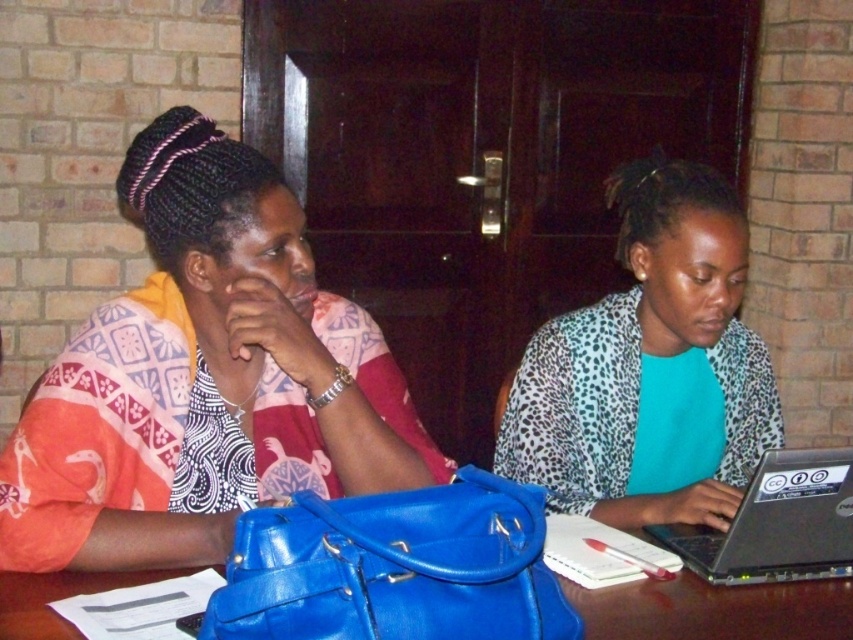
Question: Among these objects, which one is nearest to the camera?

Choices:
 (A) leopard print blazer at right
 (B) silver metallic laptop at center
 (C) blue leather bag at center
 (D) matte fabric scarf at left

Answer: (C)

Question: Which point is closer to the camera taking this photo?

Choices:
 (A) (250, 369)
 (B) (708, 268)
 (C) (793, 518)
 (D) (776, 609)

Answer: (D)

Question: Can you confirm if matte fabric scarf at left is positioned to the right of leopard print blazer at right?

Choices:
 (A) no
 (B) yes

Answer: (A)

Question: Which object is farther from the camera taking this photo?

Choices:
 (A) silver metallic laptop at center
 (B) blue leather bag at center
 (C) matte fabric scarf at left
 (D) leopard print blazer at right

Answer: (A)

Question: In this image, where is matte fabric scarf at left located relative to blue leather bag at center?

Choices:
 (A) right
 (B) left

Answer: (B)

Question: Is leopard print blazer at right thinner than silver metallic laptop at center?

Choices:
 (A) yes
 (B) no

Answer: (B)